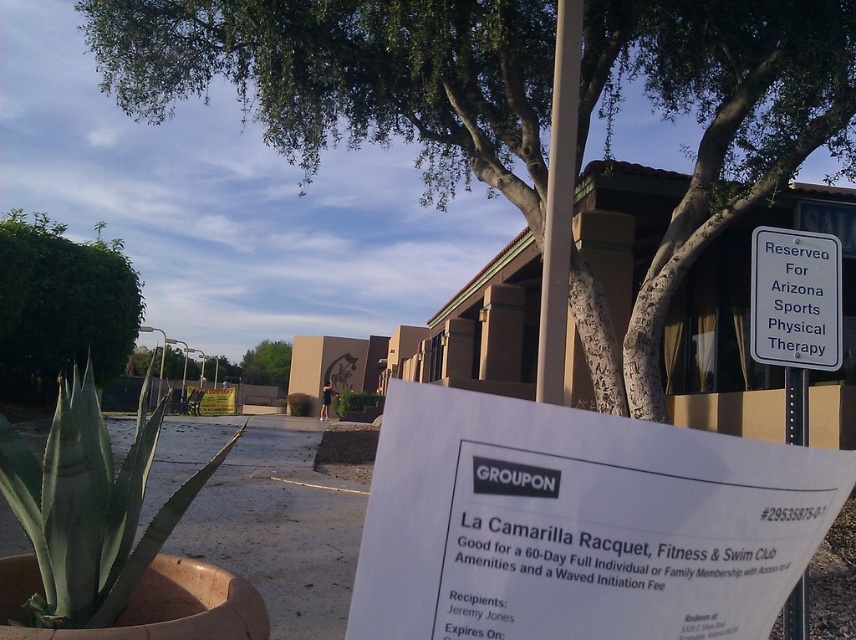
Can you confirm if green succulent at lower left is shorter than metallic pole at center?

No, green succulent at lower left is not shorter than metallic pole at center.

Does point (96, 452) come in front of point (797, 592)?

Yes, it is.

At what (x,y) coordinates should I click in order to perform the action: click on green succulent at lower left. Please return your answer as a coordinate pair (x, y). This screenshot has height=640, width=856. Looking at the image, I should click on tap(88, 506).

Does white plastic sign at upper right have a greater width compared to green leafy tree at center?

In fact, white plastic sign at upper right might be narrower than green leafy tree at center.

Who is taller, white plastic sign at upper right or green leafy tree at center?

With more height is green leafy tree at center.

Where is `white plastic sign at upper right`? The width and height of the screenshot is (856, 640). white plastic sign at upper right is located at coordinates (795, 300).

The width and height of the screenshot is (856, 640). What do you see at coordinates (795, 404) in the screenshot? I see `metallic pole at center` at bounding box center [795, 404].

Does metallic pole at center appear over green leafy plant at center?

Correct, metallic pole at center is located above green leafy plant at center.

You are a GUI agent. You are given a task and a screenshot of the screen. Output one action in this format:
    pyautogui.click(x=<x>, y=<y>)
    Task: Click on the metallic pole at center
    
    Given the screenshot: What is the action you would take?
    pyautogui.click(x=795, y=404)